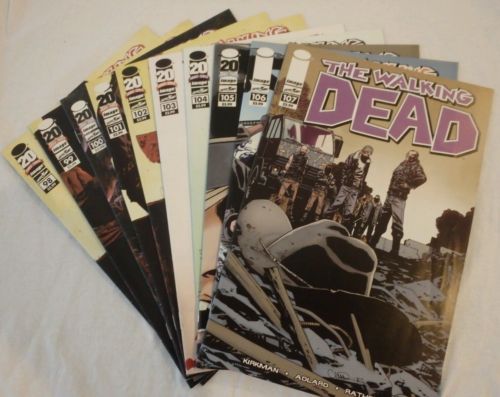
I want to click on creases on fabric, so click(x=47, y=363).